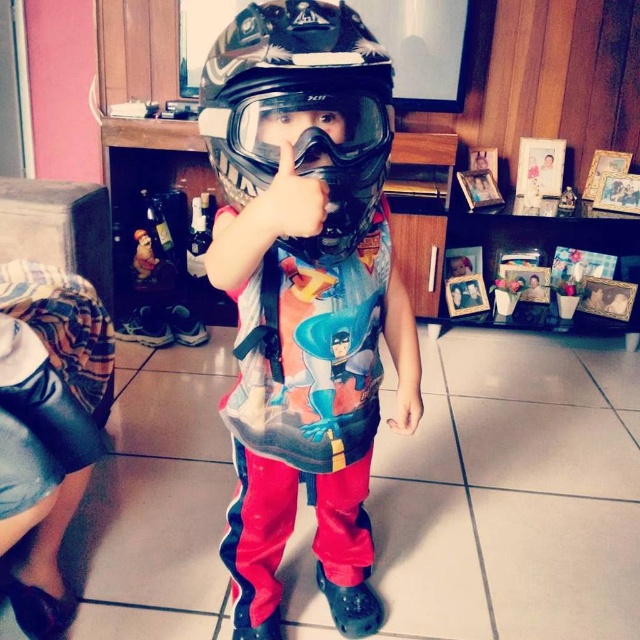
Looking at this image, you are a photographer setting up a shoot in the described indoor scene. You have two helmets, the matte black helmet at center and the camouflage matte helmet at center. Which helmet should you choose to ensure it stands out more in the frame due to its height?

The matte black helmet at center is taller than the camouflage matte helmet at center, so choosing the matte black helmet at center will make it stand out more in the frame due to its greater height.

You are a photographer trying to capture the perfect shot of the child in the racing outfit. You notice two points in the image at coordinates point (259, 250) and point (352, 125). Which point should you focus on to ensure the subject is sharp, considering their depth relative to you?

You should focus on point (259, 250) because it is closer to the viewer than point (352, 125), ensuring the subject appears sharper in the photo.

You are a photographer setting up for a photo shoot. You need to position two helmets, the matte black helmet at center and the camouflage matte helmet at center, so that they are exactly 4 inches apart. Based on the current setup, do you need to move them closer together or farther apart?

The matte black helmet at center and camouflage matte helmet at center are currently 3.84 inches apart. Since 3.84 inches is less than 4 inches, you need to move them farther apart to reach the desired distance.